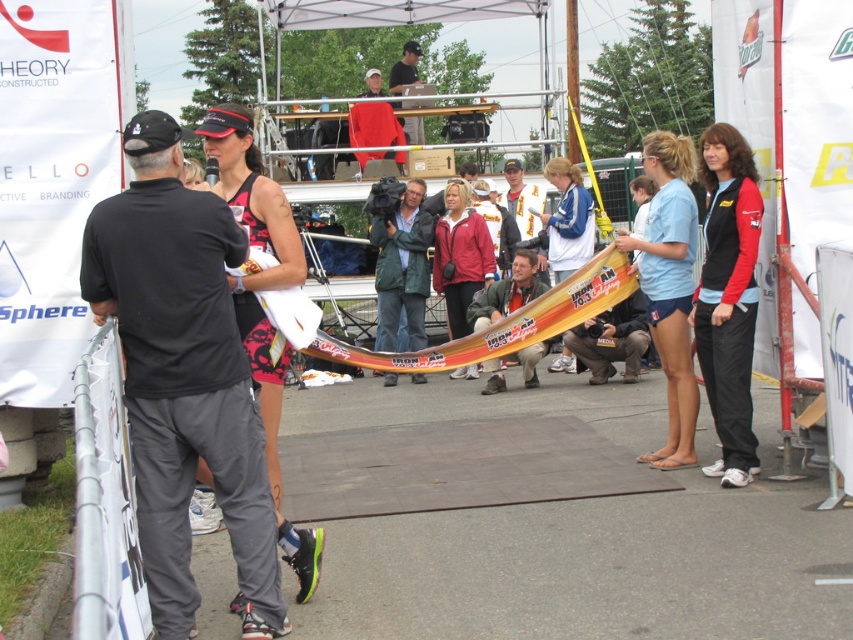
Consider the image. Is black fabric shirt at left above matte black tank top at center?

No, black fabric shirt at left is not above matte black tank top at center.

Is the position of black fabric shirt at left more distant than that of matte black tank top at center?

No.

Locate an element on the screen. This screenshot has width=853, height=640. black fabric shirt at left is located at coordinates (183, 376).

In the scene shown: Does black/red fabric vest at right have a lesser height compared to red fleece jacket at center?

No, black/red fabric vest at right is not shorter than red fleece jacket at center.

Who is more distant from viewer, (753,310) or (450,228)?

The point (450,228) is behind.

Where is `black/red fabric vest at right`? black/red fabric vest at right is located at coordinates (728, 298).

Which is more to the right, black fabric shirt at left or red fleece jacket at center?

red fleece jacket at center is more to the right.

You are a GUI agent. You are given a task and a screenshot of the screen. Output one action in this format:
    pyautogui.click(x=<x>, y=<y>)
    Task: Click on the black fabric shirt at left
    The image size is (853, 640).
    Given the screenshot: What is the action you would take?
    pyautogui.click(x=183, y=376)

Who is more distant from viewer, (134, 280) or (450, 212)?

The point (450, 212) is behind.

Identify the location of black fabric shirt at left. This screenshot has height=640, width=853. (183, 376).